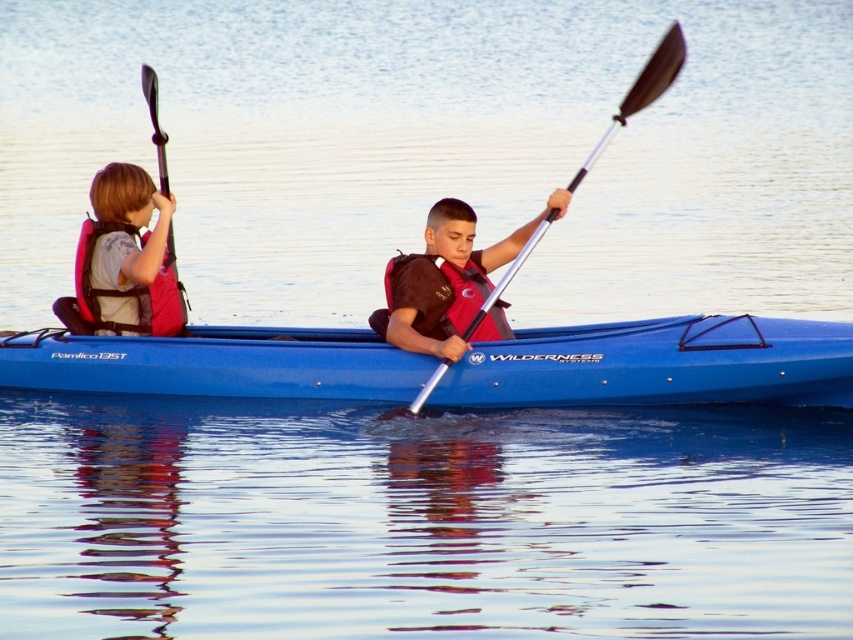
You are a photographer trying to capture a photo of the blue plastic canoe at center and the red matte life jacket at center. Since you want them both in the frame, which object should you position closer to the left side of your camera viewfinder?

The blue plastic canoe at center is to the left of the red matte life jacket at center, so to include both in the frame, position the blue plastic canoe at center closer to the left side of the camera viewfinder.

You are a safety inspector checking the distance between two life jackets on a kayak. The brown fabric life vest at center and the red matte life jacket at center must be at least 3 inches apart for proper safety regulations. Based on the image, does the current distance meet the requirement?

The distance between the brown fabric life vest at center and the red matte life jacket at center is 2.75 inches, which is less than the required 3 inches. Therefore, the current distance does not meet the safety requirement.

You are a safety inspector checking the kayakers. According to the image, is the blue plastic canoe at center positioned in a way that could interfere with the red matte life jacket at center during sudden movements?

The blue plastic canoe at center is located below the red matte life jacket at center, so it is positioned lower and less likely to interfere with the life jacket during sudden movements.